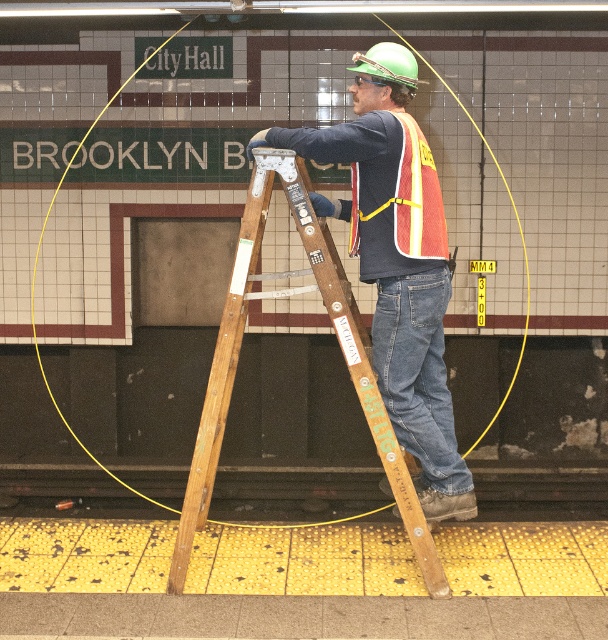
Does matte orange safety vest at center have a lesser width compared to wooden ladder at center?

Yes, matte orange safety vest at center is thinner than wooden ladder at center.

Based on the photo, measure the distance between point (x=418, y=355) and camera.

Point (x=418, y=355) and camera are 4.62 meters apart.

You are a GUI agent. You are given a task and a screenshot of the screen. Output one action in this format:
    pyautogui.click(x=<x>, y=<y>)
    Task: Click on the matte orange safety vest at center
    The width and height of the screenshot is (608, 640).
    Given the screenshot: What is the action you would take?
    pyautogui.click(x=396, y=262)

Is matte orange safety vest at center bigger than reflective orange safety vest at center?

Yes.

Looking at this image, does matte orange safety vest at center have a smaller size compared to reflective orange safety vest at center?

No.

Between point (429, 161) and point (421, 202), which one is positioned in front?

Positioned in front is point (421, 202).

Locate an element on the screen. The height and width of the screenshot is (640, 608). matte orange safety vest at center is located at coordinates (396, 262).

Is wooden ladder at center closer to the viewer compared to reflective orange safety vest at center?

No.

Is point (353, 344) closer to camera compared to point (370, 198)?

Yes, it is in front of point (370, 198).

Identify the location of wooden ladder at center. tap(340, 349).